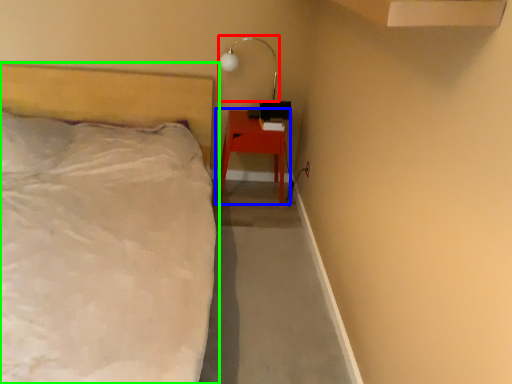
Question: Based on their relative distances, which object is nearer to lamp (highlighted by a red box)? Choose from nightstand (highlighted by a blue box) and bed (highlighted by a green box).

Choices:
 (A) nightstand
 (B) bed

Answer: (A)